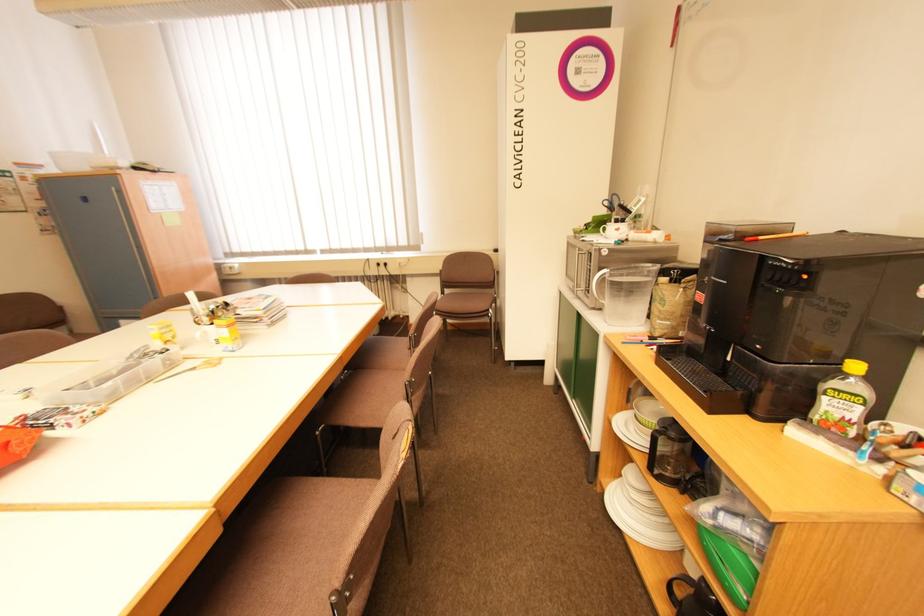
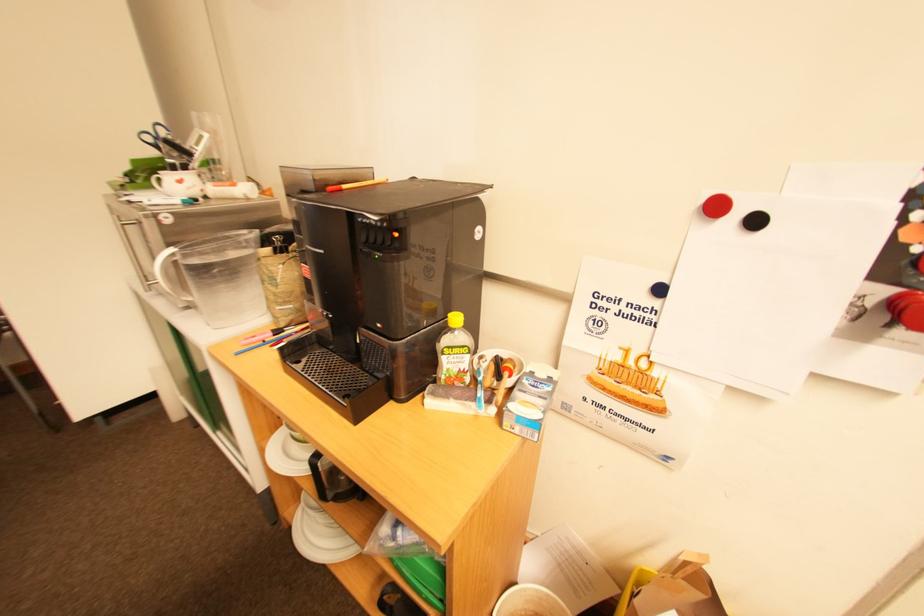
Question: The camera is either moving clockwise (left) or counter-clockwise (right) around the object. The first image is from the beginning of the video and the second image is from the end. Is the camera moving left or right when shooting the video?

Choices:
 (A) Left
 (B) Right

Answer: (A)